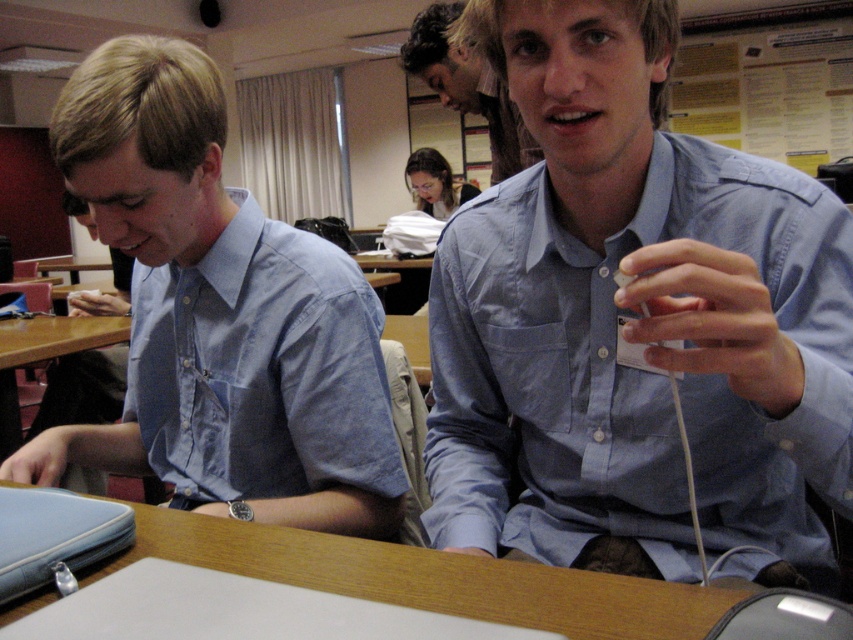
Question: Among these points, which one is farthest from the camera?

Choices:
 (A) (573, 460)
 (B) (337, 422)
 (C) (426, 157)

Answer: (C)

Question: Does blue shirt at upper center appear over matte black hair at upper center?

Choices:
 (A) yes
 (B) no

Answer: (B)

Question: Which point appears farthest from the camera in this image?

Choices:
 (A) (822, 460)
 (B) (172, 195)

Answer: (B)

Question: Does blue shirt at left lie behind matte black hair at upper center?

Choices:
 (A) yes
 (B) no

Answer: (B)

Question: Which point is farther to the camera?

Choices:
 (A) blue shirt at center
 (B) blue shirt at left

Answer: (B)

Question: Can you confirm if blue shirt at left is positioned above blue shirt at upper center?

Choices:
 (A) no
 (B) yes

Answer: (A)